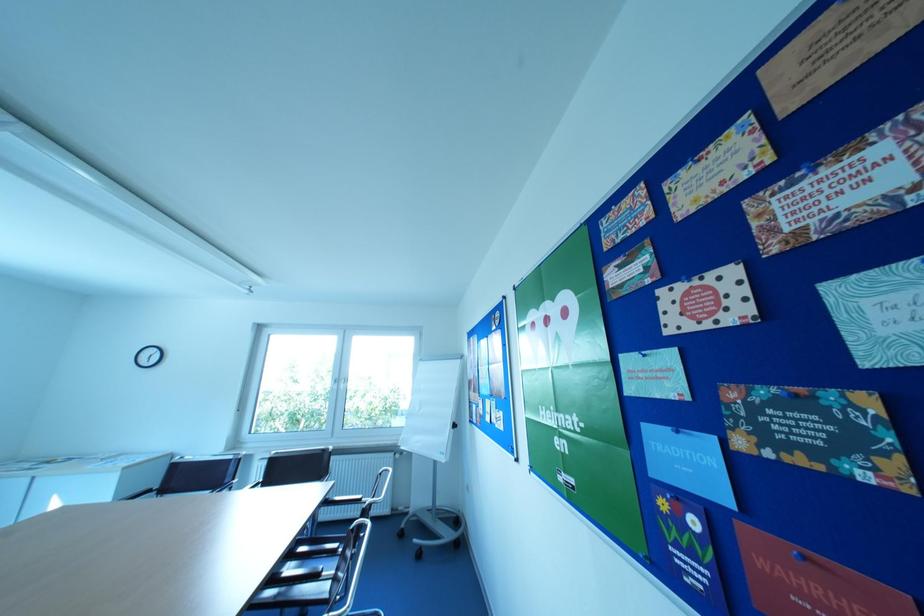
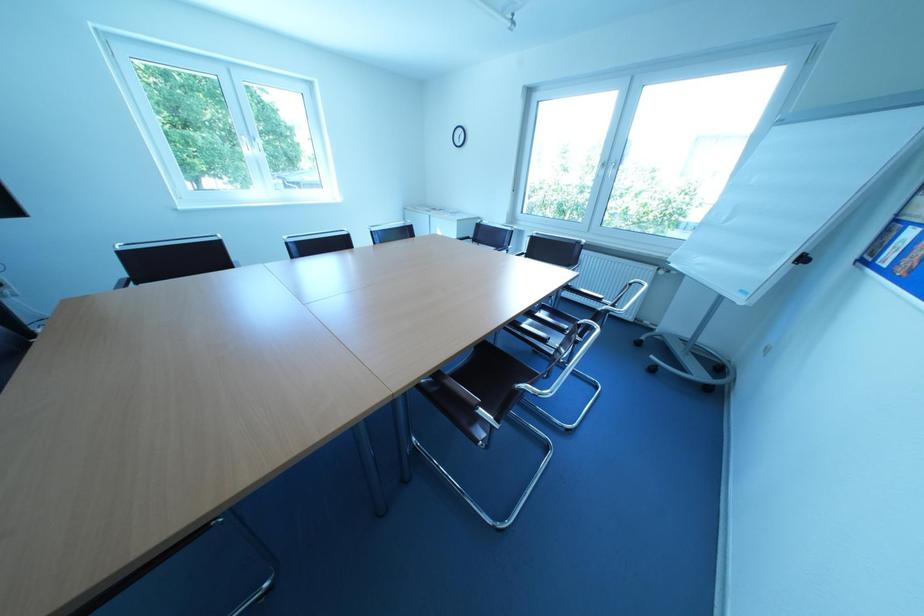
First-person continuous shooting, in which direction is the camera rotating?

The rotation direction of the camera is left-down.